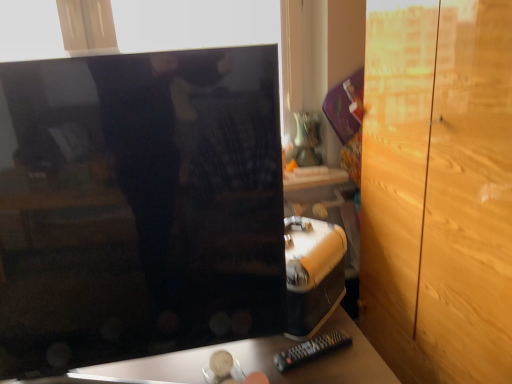
Locate an element on the screen. The width and height of the screenshot is (512, 384). matte black tv at center is located at coordinates (255, 362).

Where is `glossy black monitor at center`? The height and width of the screenshot is (384, 512). glossy black monitor at center is located at coordinates (139, 204).

What do you see at coordinates (310, 350) in the screenshot?
I see `black plastic remote at lower center` at bounding box center [310, 350].

Locate an element on the screen. This screenshot has width=512, height=384. matte black tv at center is located at coordinates (255, 362).

From the image's perspective, is matte black tv at center located above or below black plastic remote at lower center?

Clearly, from the image's perspective, matte black tv at center is below black plastic remote at lower center.

This screenshot has width=512, height=384. I want to click on remote positioned vertically above the matte black tv at center (from a real-world perspective), so click(x=310, y=350).

Between matte black tv at center and black plastic remote at lower center, which one has larger size?

matte black tv at center.

From the image's perspective, is matte black tv at center positioned above or below light brown wood dresser at right?

matte black tv at center is situated lower than light brown wood dresser at right in the image.

Between matte black tv at center and light brown wood dresser at right, which one is positioned in front?

light brown wood dresser at right is closer to the camera.

I want to click on furniture behind the light brown wood dresser at right, so click(x=255, y=362).

Is matte black tv at center positioned behind glossy black monitor at center?

Yes, it is behind glossy black monitor at center.

From a real-world perspective, between matte black tv at center and glossy black monitor at center, who is vertically lower?

matte black tv at center, from a real-world perspective.

Which of these two, matte black tv at center or glossy black monitor at center, stands taller?

glossy black monitor at center is taller.

From a real-world perspective, relative to black plastic remote at lower center, is glossy black monitor at center vertically above or below?

In terms of real-world spatial position, glossy black monitor at center is above black plastic remote at lower center.

Is glossy black monitor at center far from black plastic remote at lower center?

No, glossy black monitor at center is in close proximity to black plastic remote at lower center.

Between glossy black monitor at center and black plastic remote at lower center, which one has less height?

With less height is black plastic remote at lower center.

Based on the photo, is black plastic remote at lower center located within glossy black monitor at center?

Definitely not — black plastic remote at lower center is not inside glossy black monitor at center.

Which of these two, black plastic remote at lower center or glossy black monitor at center, is bigger?

Bigger between the two is glossy black monitor at center.

Which object is more forward, black plastic remote at lower center or glossy black monitor at center?

glossy black monitor at center is in front.

Is glossy black monitor at center at the back of black plastic remote at lower center?

Yes, black plastic remote at lower center's orientation is away from glossy black monitor at center.

Is light brown wood dresser at right at the back of black plastic remote at lower center?

black plastic remote at lower center does not have its back to light brown wood dresser at right.

Between black plastic remote at lower center and light brown wood dresser at right, which one has more height?

With more height is light brown wood dresser at right.

From the image's perspective, is black plastic remote at lower center located above or below light brown wood dresser at right?

From the image's perspective, black plastic remote at lower center appears below light brown wood dresser at right.

Is black plastic remote at lower center far from light brown wood dresser at right?

No, there isn't a large distance between black plastic remote at lower center and light brown wood dresser at right.

Who is taller, black plastic remote at lower center or matte black tv at center?

With more height is matte black tv at center.

Which is behind, black plastic remote at lower center or matte black tv at center?

Positioned behind is black plastic remote at lower center.

Is black plastic remote at lower center in contact with matte black tv at center?

No, black plastic remote at lower center is not in contact with matte black tv at center.

Is matte black tv at center completely or partially inside black plastic remote at lower center?

No.

Locate an element on the screen. Image resolution: width=512 pixels, height=384 pixels. remote behind the matte black tv at center is located at coordinates (310, 350).

Identify the location of furniture below the light brown wood dresser at right (from a real-world perspective). This screenshot has height=384, width=512. (255, 362).

From the image, which object appears to be farther from black plastic remote at lower center, light brown wood dresser at right or matte black tv at center?

light brown wood dresser at right.

When comparing their distances from black plastic remote at lower center, does glossy black monitor at center or light brown wood dresser at right seem closer?

glossy black monitor at center is closer to black plastic remote at lower center.

Estimate the real-world distances between objects in this image. Which object is closer to glossy black monitor at center, light brown wood dresser at right or black plastic remote at lower center?

black plastic remote at lower center is positioned closer to the anchor glossy black monitor at center.

Considering their positions, is black plastic remote at lower center positioned closer to matte black tv at center than glossy black monitor at center?

black plastic remote at lower center is positioned closer to the anchor matte black tv at center.

When comparing their distances from matte black tv at center, does glossy black monitor at center or black plastic remote at lower center seem closer?

Among the two, black plastic remote at lower center is located nearer to matte black tv at center.

Considering their positions, is light brown wood dresser at right positioned closer to matte black tv at center than black plastic remote at lower center?

The object closer to matte black tv at center is black plastic remote at lower center.

Looking at the image, which one is located further to matte black tv at center, glossy black monitor at center or light brown wood dresser at right?

Based on the image, light brown wood dresser at right appears to be further to matte black tv at center.

Considering their positions, is black plastic remote at lower center positioned closer to light brown wood dresser at right than glossy black monitor at center?

The object closer to light brown wood dresser at right is black plastic remote at lower center.

You are a GUI agent. You are given a task and a screenshot of the screen. Output one action in this format:
    pyautogui.click(x=<x>, y=<y>)
    Task: Click on the remote between matte black tv at center and light brown wood dresser at right in the horizontal direction
    
    Given the screenshot: What is the action you would take?
    (x=310, y=350)

I want to click on remote between glossy black monitor at center and matte black tv at center vertically, so click(x=310, y=350).

I want to click on furniture between glossy black monitor at center and light brown wood dresser at right, so click(255, 362).

At what (x,y) coordinates should I click in order to perform the action: click on remote between glossy black monitor at center and light brown wood dresser at right in the horizontal direction. Please return your answer as a coordinate pair (x, y). Looking at the image, I should click on (x=310, y=350).